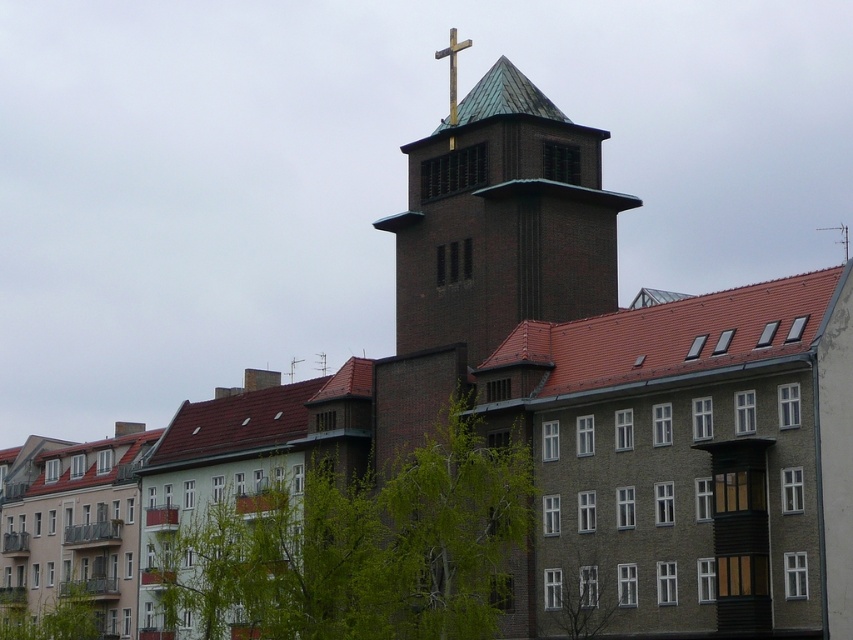
Does brown brick tower at center have a greater width compared to gold metallic cross at upper center?

Yes.

Which is above, brown brick tower at center or gold metallic cross at upper center?

gold metallic cross at upper center

Who is more distant from viewer, (428,342) or (433,54)?

The point (433,54) is more distant.

Where is `brown brick tower at center`? brown brick tower at center is located at coordinates click(x=502, y=221).